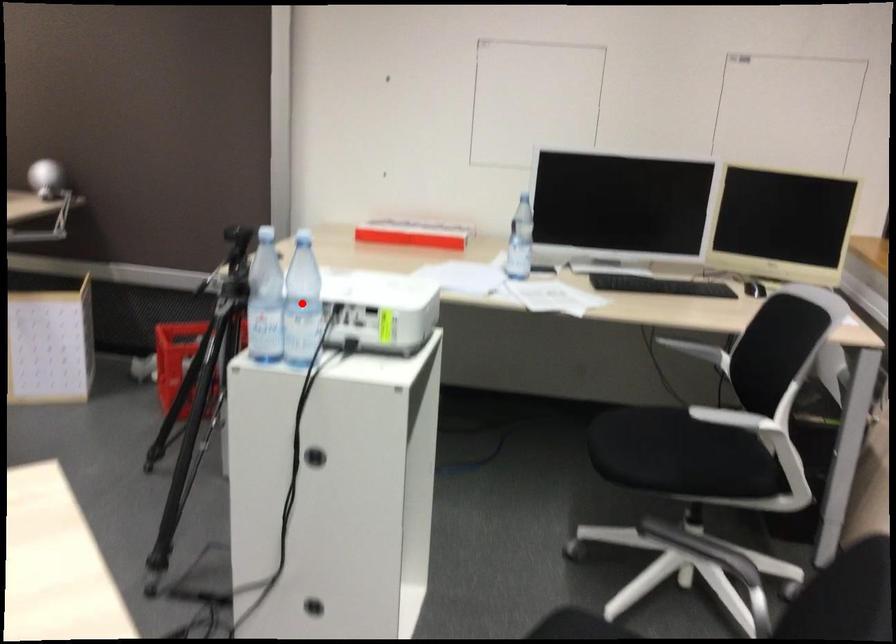
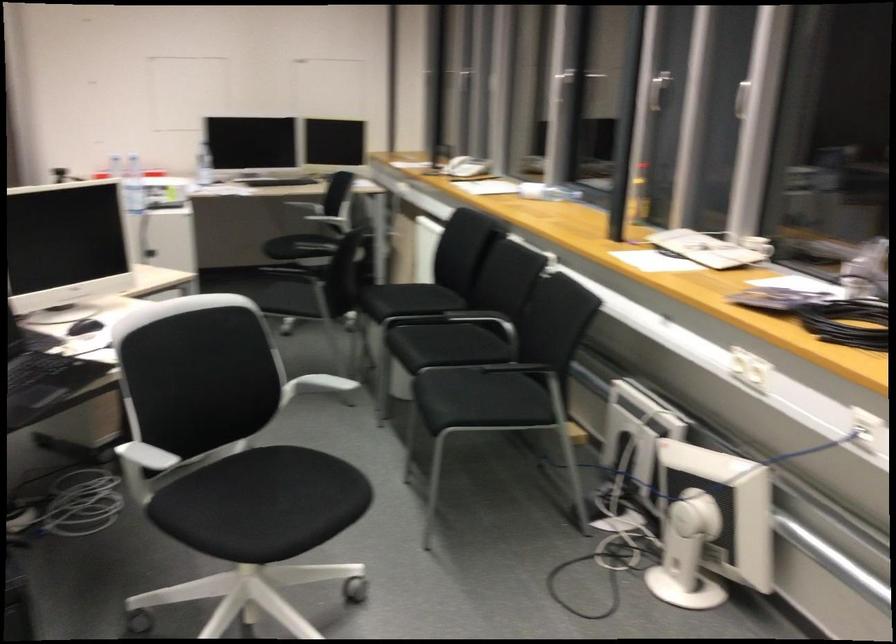
Question: I am providing you with two images of the same scene from different viewpoints. A red point is marked on the first image. Is the red point's position out of view in image 2?

Choices:
 (A) Yes
 (B) No

Answer: (A)